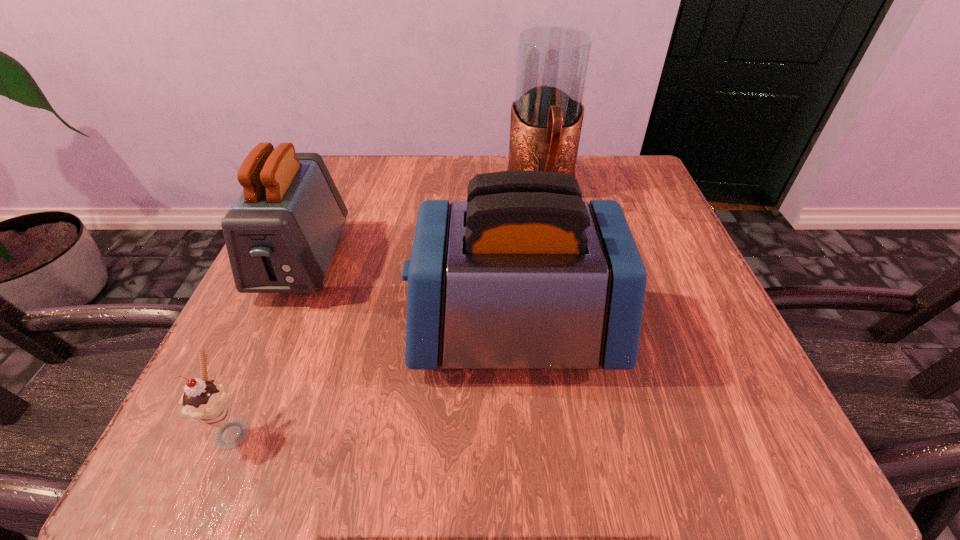
Where is `free location at the right edge of the desktop`? This screenshot has height=540, width=960. free location at the right edge of the desktop is located at coordinates (681, 248).

You are a GUI agent. You are given a task and a screenshot of the screen. Output one action in this format:
    pyautogui.click(x=<x>, y=<y>)
    Task: Click on the free space at the far left corner
    The width and height of the screenshot is (960, 540).
    Given the screenshot: What is the action you would take?
    pyautogui.click(x=330, y=159)

Where is `free region at the near left corner of the desktop`? free region at the near left corner of the desktop is located at coordinates (207, 436).

You are a GUI agent. You are given a task and a screenshot of the screen. Output one action in this format:
    pyautogui.click(x=<x>, y=<y>)
    Task: Click on the free space at the far right corner of the desktop
    This screenshot has height=540, width=960.
    Given the screenshot: What is the action you would take?
    pyautogui.click(x=633, y=199)

In the image, there is a desktop. Identify the location of vacant region at the near right corner. (702, 454).

At what (x,y) coordinates should I click in order to perform the action: click on free spot between the nearest object and the third tallest object. Please return your answer as a coordinate pair (x, y). The height and width of the screenshot is (540, 960). Looking at the image, I should click on (268, 345).

Image resolution: width=960 pixels, height=540 pixels. Identify the location of vacant region between the shorter toaster and the shortest object. (268, 345).

You are a GUI agent. You are given a task and a screenshot of the screen. Output one action in this format:
    pyautogui.click(x=<x>, y=<y>)
    Task: Click on the free space between the icecream and the right toaster
    
    Given the screenshot: What is the action you would take?
    pyautogui.click(x=374, y=380)

Where is `vacant space that's between the nearest object and the farthest object`? This screenshot has height=540, width=960. vacant space that's between the nearest object and the farthest object is located at coordinates (387, 309).

I want to click on vacant region between the farthest object and the nearest object, so click(x=387, y=309).